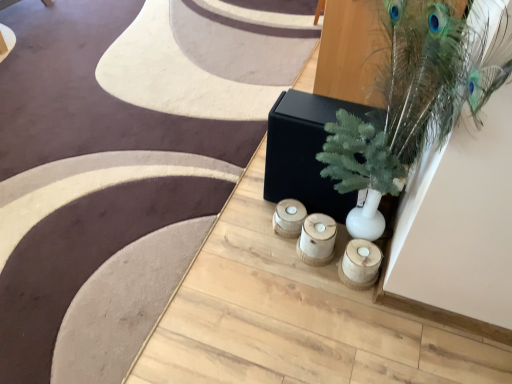
Question: Can you confirm if wooden candle holders at center, which is the 2th candle holder from right to left, is taller than wooden candle holder at lower center, acting as the 1th candle holder starting from the right?

Choices:
 (A) no
 (B) yes

Answer: (B)

Question: Is wooden candle holders at center, the first candle holder positioned from the left, behind wooden candle holder at lower center, positioned as the second candle holder in left-to-right order?

Choices:
 (A) no
 (B) yes

Answer: (B)

Question: Considering the relative sizes of wooden candle holders at center, which is the 2th candle holder from right to left, and wooden candle holder at lower center, acting as the 1th candle holder starting from the right, in the image provided, is wooden candle holders at center, which is the 2th candle holder from right to left, wider than wooden candle holder at lower center, acting as the 1th candle holder starting from the right,?

Choices:
 (A) yes
 (B) no

Answer: (A)

Question: Does wooden candle holders at center, the first candle holder positioned from the left, have a lesser width compared to wooden candle holder at lower center, acting as the 1th candle holder starting from the right?

Choices:
 (A) yes
 (B) no

Answer: (B)

Question: Is wooden candle holders at center, the first candle holder positioned from the left, smaller than wooden candle holder at lower center, acting as the 1th candle holder starting from the right?

Choices:
 (A) yes
 (B) no

Answer: (B)

Question: Does wooden candle holders at center, the first candle holder positioned from the left, touch wooden candle holder at lower center, positioned as the second candle holder in left-to-right order?

Choices:
 (A) no
 (B) yes

Answer: (A)

Question: Does wooden candle holder at lower center, acting as the 1th candle holder starting from the right, have a lesser width compared to wooden candle holders at center, which is the 2th candle holder from right to left?

Choices:
 (A) no
 (B) yes

Answer: (B)

Question: Is wooden candle holder at lower center, positioned as the second candle holder in left-to-right order, further to the viewer compared to wooden candle holders at center, the first candle holder positioned from the left?

Choices:
 (A) yes
 (B) no

Answer: (B)

Question: Is wooden candle holder at lower center, acting as the 1th candle holder starting from the right, bigger than wooden candle holders at center, the first candle holder positioned from the left?

Choices:
 (A) yes
 (B) no

Answer: (B)

Question: From the image's perspective, would you say wooden candle holder at lower center, positioned as the second candle holder in left-to-right order, is shown under wooden candle holders at center, the first candle holder positioned from the left?

Choices:
 (A) yes
 (B) no

Answer: (A)

Question: Is wooden candle holder at lower center, acting as the 1th candle holder starting from the right, at the left side of wooden candle holders at center, which is the 2th candle holder from right to left?

Choices:
 (A) no
 (B) yes

Answer: (A)

Question: Is wooden candle holder at lower center, positioned as the second candle holder in left-to-right order, turned away from wooden candle holders at center, which is the 2th candle holder from right to left?

Choices:
 (A) yes
 (B) no

Answer: (B)

Question: Does white matte vase at upper right have a greater width compared to wooden candle holder at lower center, acting as the 1th candle holder starting from the right?

Choices:
 (A) yes
 (B) no

Answer: (A)